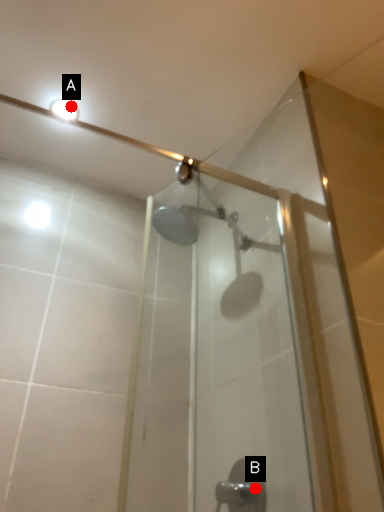
Question: Two points are circled on the image, labeled by A and B beside each circle. Which point appears closest to the camera in this image?

Choices:
 (A) A is closer
 (B) B is closer

Answer: (B)